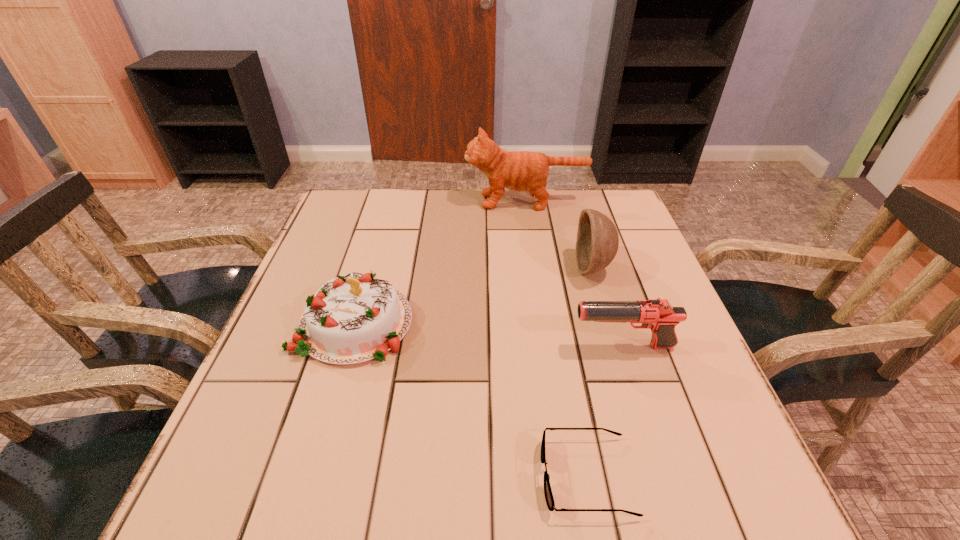
At what (x,y) coordinates should I click in order to perform the action: click on vacant space at the far right corner of the desktop. Please return your answer as a coordinate pair (x, y). Looking at the image, I should click on (596, 210).

Where is `blank region between the cake and the gun`? This screenshot has width=960, height=540. blank region between the cake and the gun is located at coordinates (489, 335).

Locate an element on the screen. The width and height of the screenshot is (960, 540). unoccupied area between the nearest object and the tallest object is located at coordinates (556, 339).

Image resolution: width=960 pixels, height=540 pixels. In order to click on empty space that is in between the tallest object and the cake in this screenshot , I will do `click(440, 262)`.

Identify the location of unoccupied position between the leftmost object and the bowl. Image resolution: width=960 pixels, height=540 pixels. (473, 296).

Find the location of `free spot between the gun and the tallest object`. free spot between the gun and the tallest object is located at coordinates (574, 274).

You are a GUI agent. You are given a task and a screenshot of the screen. Output one action in this format:
    pyautogui.click(x=<x>, y=<y>)
    Task: Click on the vacant point located between the gun and the tallest object
    
    Given the screenshot: What is the action you would take?
    pyautogui.click(x=574, y=274)

Find the location of a particular element. The image size is (960, 540). free spot between the bowl and the spectacles is located at coordinates pos(589,372).

Find the location of a particular element. unoccupied position between the cake and the gun is located at coordinates (489, 335).

The height and width of the screenshot is (540, 960). What are the coordinates of `vacant space that is in between the second tallest object and the cake` in the screenshot? It's located at (473, 296).